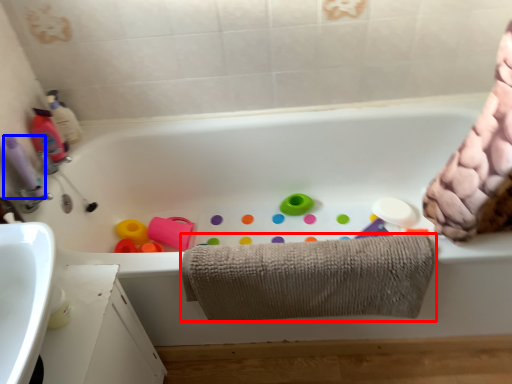
Question: Among these objects, which one is farthest to the camera, towel (highlighted by a red box) or cleaning product (highlighted by a blue box)?

Choices:
 (A) towel
 (B) cleaning product

Answer: (B)